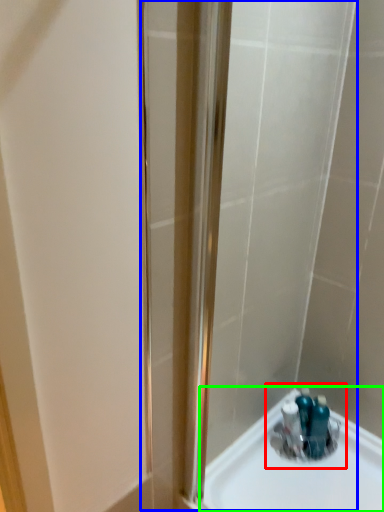
Question: Based on their relative distances, which object is nearer to sink (highlighted by a red box)? Choose from shower door (highlighted by a blue box) and sink (highlighted by a green box).

Choices:
 (A) shower door
 (B) sink

Answer: (B)